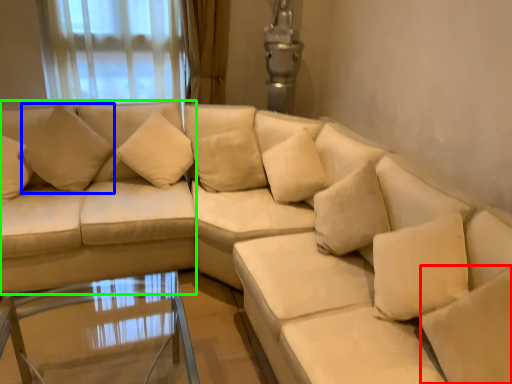
Question: Estimate the real-world distances between objects in this image. Which object is farther from pillow (highlighted by a red box), pillow (highlighted by a blue box) or couch (highlighted by a green box)?

Choices:
 (A) pillow
 (B) couch

Answer: (A)